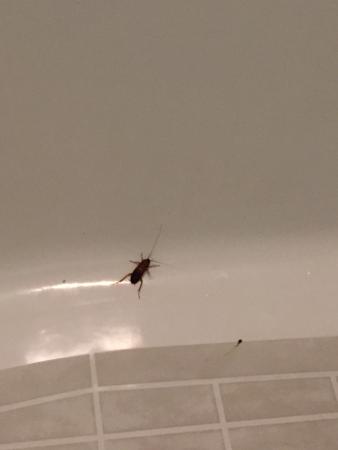
The image size is (338, 450). I want to click on tub, so click(266, 372).